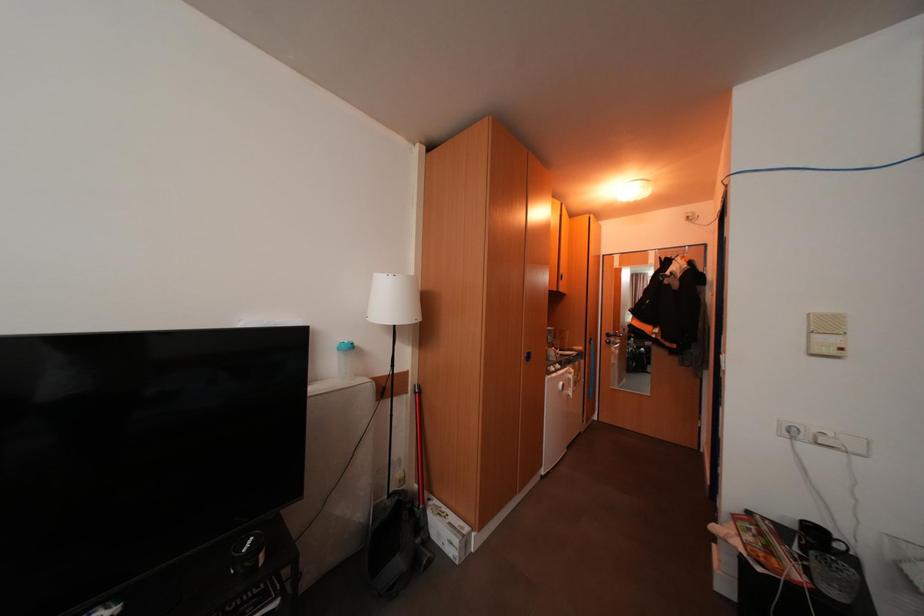
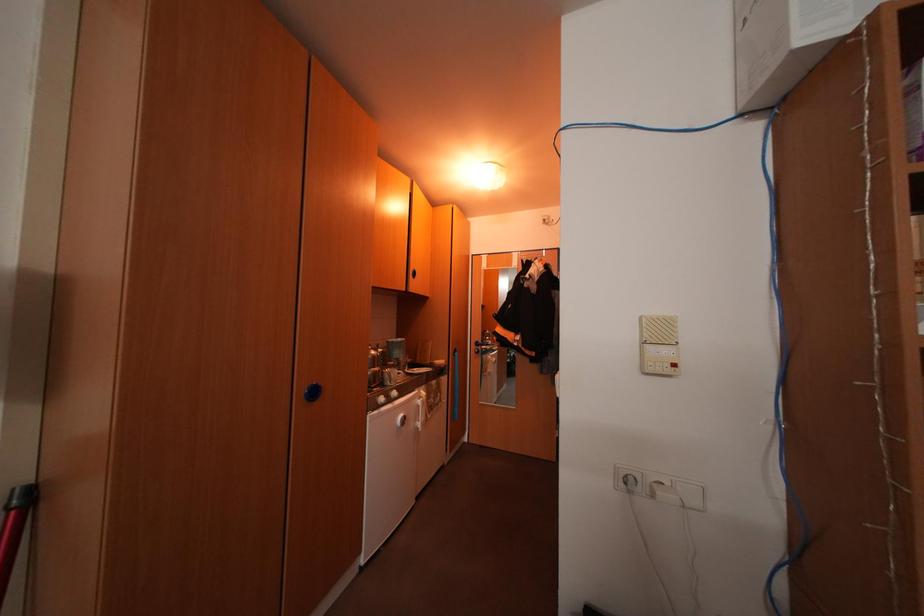
Question: The camera is either moving clockwise (left) or counter-clockwise (right) around the object. The first image is from the beginning of the video and the second image is from the end. Is the camera moving left or right when shooting the video?

Choices:
 (A) Left
 (B) Right

Answer: (A)